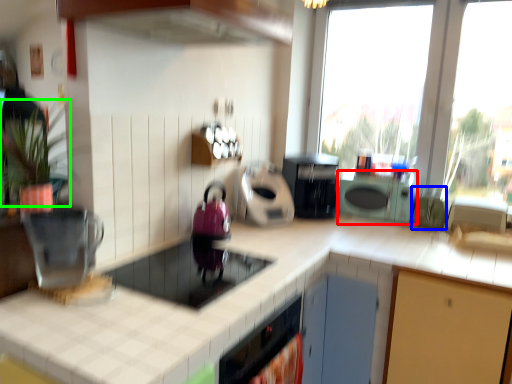
Question: Which object is positioned farthest from cabinetry (highlighted by a red box)? Select from appliance (highlighted by a blue box) and plant (highlighted by a green box).

Choices:
 (A) appliance
 (B) plant

Answer: (B)